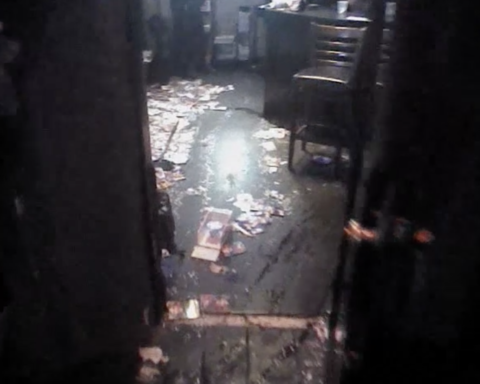
Locate an element on the screen. door frame is located at coordinates (135, 63).